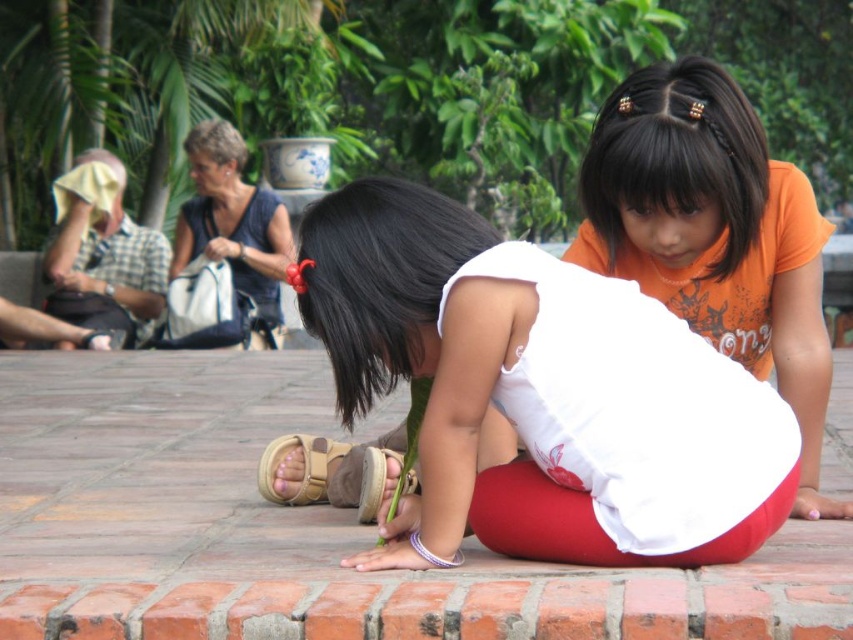
Question: Which of the following is the closest to the observer?

Choices:
 (A) short blond hair at upper left
 (B) tan suede sandal at lower center
 (C) black silky hair at center

Answer: (C)

Question: Can you confirm if orange cotton shirt at upper right is wider than short blond hair at upper left?

Choices:
 (A) no
 (B) yes

Answer: (B)

Question: Which point is farther from the camera taking this photo?

Choices:
 (A) (235, 152)
 (B) (659, 348)
 (C) (602, 266)
 (D) (408, 186)

Answer: (A)

Question: Which point is closer to the camera?

Choices:
 (A) orange cotton shirt at upper right
 (B) black silky hair at upper center
 (C) short blond hair at upper left

Answer: (B)

Question: Can you confirm if blue fabric purse at upper left is positioned above short blond hair at upper left?

Choices:
 (A) no
 (B) yes

Answer: (A)

Question: Observing the image, what is the correct spatial positioning of black silky hair at center in reference to tan suede sandal at lower center?

Choices:
 (A) left
 (B) right

Answer: (B)